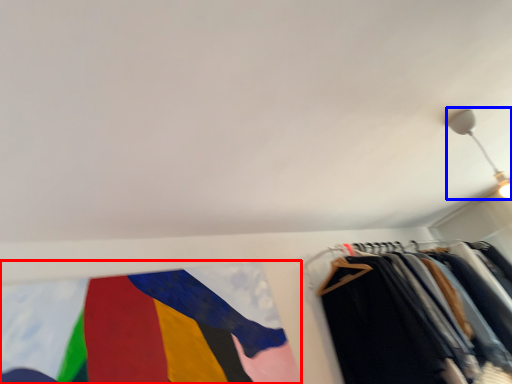
Question: Among these objects, which one is farthest to the camera, flag (highlighted by a red box) or light fixture (highlighted by a blue box)?

Choices:
 (A) flag
 (B) light fixture

Answer: (B)